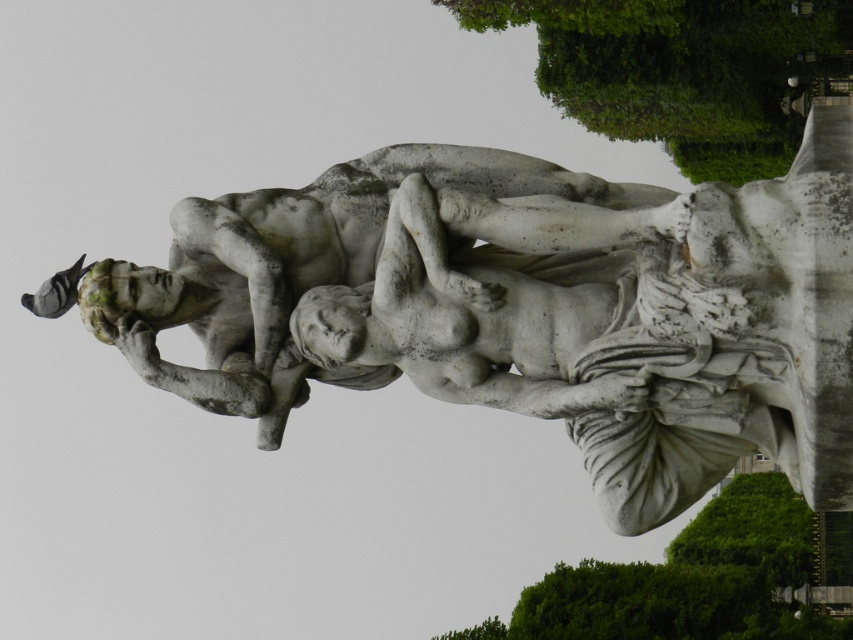
You are an art conservator assessing the placement of the white marble statue at center and the green leafy tree at lower right in the sculpture garden. Considering their sizes, which object takes up more space in the garden?

The green leafy tree at lower right takes up more space than the white marble statue at center, as the white marble statue at center occupies less space than green leafy tree at lower right.